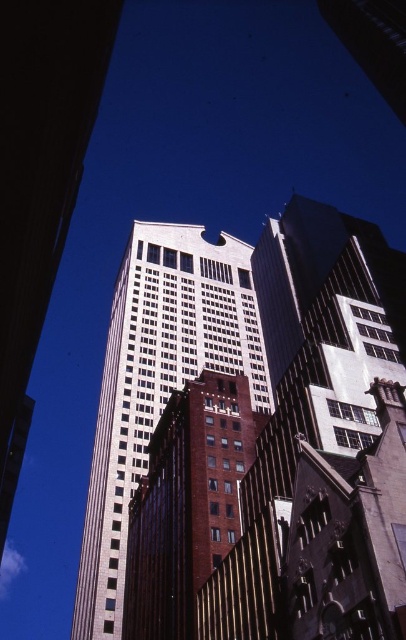
Identify the location of white glass building at center. The width and height of the screenshot is (406, 640). (157, 380).

This screenshot has height=640, width=406. Describe the element at coordinates (157, 380) in the screenshot. I see `white glass building at center` at that location.

At what (x,y) coordinates should I click in order to perform the action: click on white glass building at center. Please return your answer as a coordinate pair (x, y). The image size is (406, 640). Looking at the image, I should click on (157, 380).